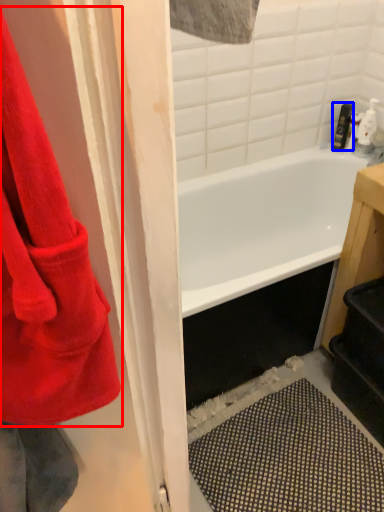
Question: Which of the following is the closest to the observer, towel (highlighted by a red box) or toiletry (highlighted by a blue box)?

Choices:
 (A) towel
 (B) toiletry

Answer: (A)